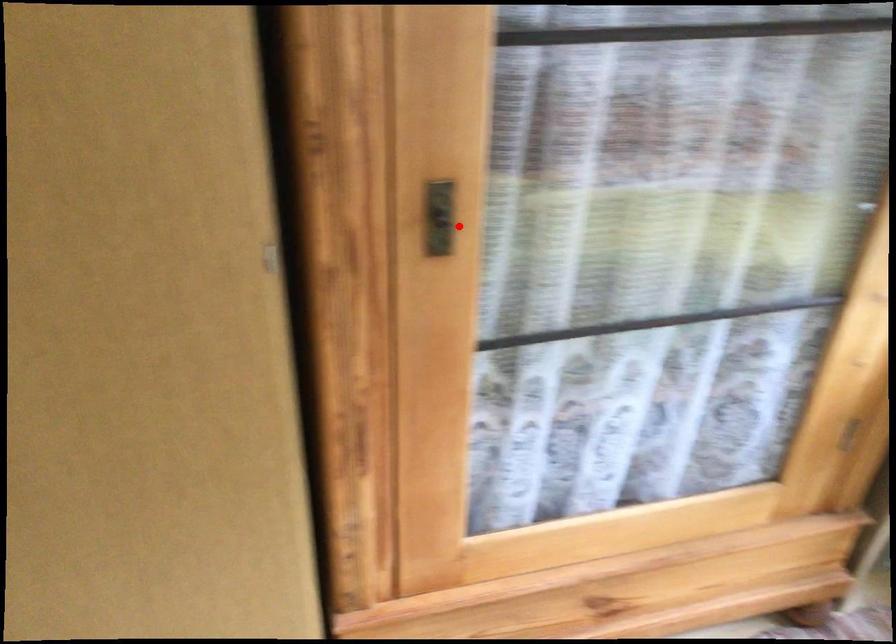
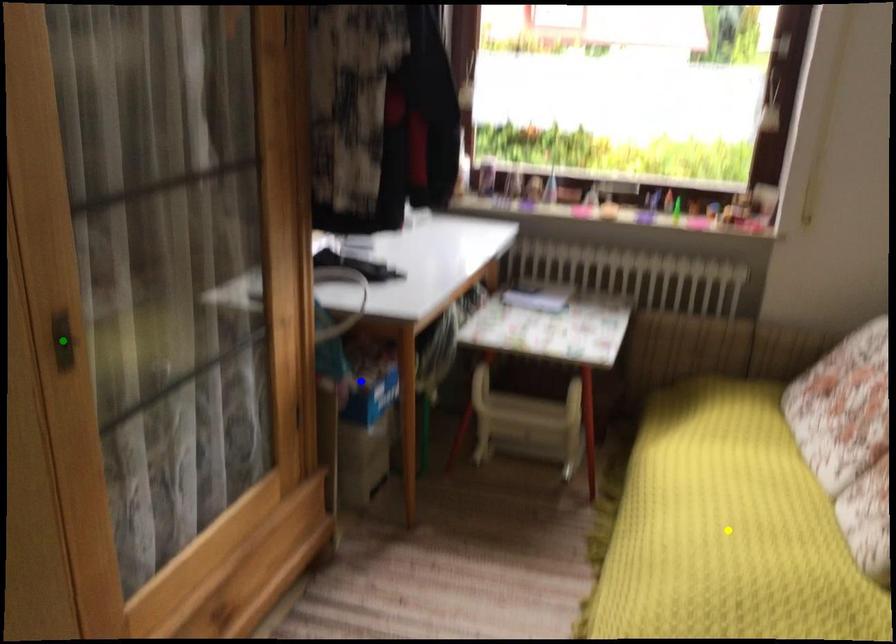
Question: I am providing you with two images of the same scene from different viewpoints. A red point is marked on the first image. You are given multiple points on the second image. In image 2, which mark is for the same physical point as the one in image 1?

Choices:
 (A) blue point
 (B) yellow point
 (C) green point

Answer: (C)